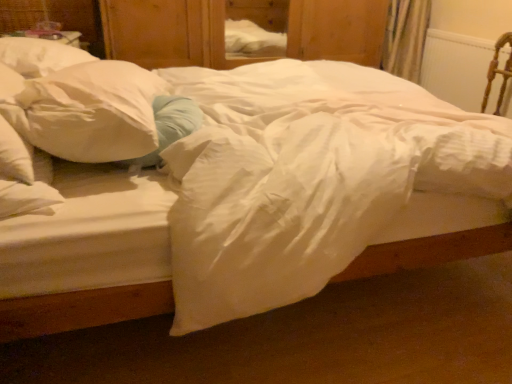
What do you see at coordinates (167, 33) in the screenshot? I see `wooden dresser at center` at bounding box center [167, 33].

The height and width of the screenshot is (384, 512). I want to click on wooden dresser at center, so click(167, 33).

Locate an element on the screen. wooden armchair at right is located at coordinates (498, 72).

At what (x,y) coordinates should I click in order to perform the action: click on white plastic radiator at upper right. Please return your answer as a coordinate pair (x, y). This screenshot has height=384, width=512. Looking at the image, I should click on (456, 67).

At what (x,y) coordinates should I click in order to perform the action: click on wooden dresser at center. Please return your answer as a coordinate pair (x, y). The width and height of the screenshot is (512, 384). Looking at the image, I should click on point(167,33).

Is white plastic radiator at upper right taller than white soft pillow at left?

Yes, white plastic radiator at upper right is taller than white soft pillow at left.

Would you say white soft pillow at left is part of white plastic radiator at upper right's contents?

No, white soft pillow at left is not surrounded by white plastic radiator at upper right.

Between white plastic radiator at upper right and white soft pillow at left, which one is positioned behind?

white plastic radiator at upper right.

Is there a large distance between white plastic radiator at upper right and white soft pillow at left?

Indeed, white plastic radiator at upper right is not near white soft pillow at left.

Locate an element on the screen. This screenshot has height=384, width=512. dresser on the left side of wooden armchair at right is located at coordinates (167, 33).

Considering the positions of point (324, 55) and point (499, 71), is point (324, 55) closer or farther from the camera than point (499, 71)?

Point (324, 55) is farther from the camera than point (499, 71).

Is wooden dresser at center positioned with its back to wooden armchair at right?

No, wooden dresser at center's orientation is not away from wooden armchair at right.

From the picture: From a real-world perspective, is wooden dresser at center on top of wooden armchair at right?

Yes, from a real-world perspective, wooden dresser at center is over wooden armchair at right

Which is farther, (485, 92) or (201, 4)?

The point (201, 4) is farther from the camera.

In the scene shown: Are wooden armchair at right and wooden dresser at center beside each other?

No, wooden armchair at right is not beside wooden dresser at center.

Looking at the image, does wooden armchair at right seem bigger or smaller compared to wooden dresser at center?

wooden armchair at right is smaller than wooden dresser at center.

At what (x,y) coordinates should I click in order to perform the action: click on pillow lying on the left of wooden armchair at right. Please return your answer as a coordinate pair (x, y). This screenshot has width=512, height=384. Looking at the image, I should click on (91, 112).

Which object is closer to the camera taking this photo, white soft pillow at left or wooden armchair at right?

white soft pillow at left.

Based on their positions, is white soft pillow at left located to the left or right of wooden armchair at right?

Clearly, white soft pillow at left is on the left of wooden armchair at right in the image.

In terms of width, does white plastic radiator at upper right look wider or thinner when compared to wooden armchair at right?

white plastic radiator at upper right is thinner than wooden armchair at right.

Relative to wooden armchair at right, is white plastic radiator at upper right in front or behind?

Visually, white plastic radiator at upper right is located behind wooden armchair at right.

From the image's perspective, does white plastic radiator at upper right appear lower than wooden armchair at right?

No, from the image's perspective, white plastic radiator at upper right is not below wooden armchair at right.

Between point (446, 32) and point (488, 70), which one is positioned in front?

Positioned in front is point (488, 70).

Is wooden dresser at center taller or shorter than white soft pillow at left?

Considering their sizes, wooden dresser at center has more height than white soft pillow at left.

Is the depth of wooden dresser at center greater than that of white soft pillow at left?

Yes, wooden dresser at center is behind white soft pillow at left.

Is wooden dresser at center wider or thinner than white soft pillow at left?

Clearly, wooden dresser at center has more width compared to white soft pillow at left.

In the image, is white soft pillow at left on the left side or the right side of white plastic radiator at upper right?

white soft pillow at left is positioned on white plastic radiator at upper right's left side.

In the scene shown: Between white soft pillow at left and white plastic radiator at upper right, which one has more height?

white plastic radiator at upper right.

Considering the sizes of objects white soft pillow at left and white plastic radiator at upper right in the image provided, who is thinner, white soft pillow at left or white plastic radiator at upper right?

Thinner between the two is white plastic radiator at upper right.

Looking at this image, from the image's perspective, is white soft pillow at left below white plastic radiator at upper right?

Yes.

Locate an element on the screen. The image size is (512, 384). radiator above the white soft pillow at left (from the image's perspective) is located at coordinates (456, 67).

You are a GUI agent. You are given a task and a screenshot of the screen. Output one action in this format:
    pyautogui.click(x=<x>, y=<y>)
    Task: Click on the armchair that is on the right side of wooden dresser at center
    This screenshot has height=384, width=512.
    Given the screenshot: What is the action you would take?
    pyautogui.click(x=498, y=72)

When comparing their distances from white soft pillow at left, does wooden armchair at right or wooden dresser at center seem further?

wooden armchair at right.

Which object lies nearer to the anchor point white soft pillow at left, wooden dresser at center or white plastic radiator at upper right?

The object closer to white soft pillow at left is wooden dresser at center.

In the scene shown: Which object lies nearer to the anchor point wooden dresser at center, white soft pillow at left or wooden armchair at right?

Based on the image, white soft pillow at left appears to be nearer to wooden dresser at center.

From the image, which object appears to be farther from white plastic radiator at upper right, wooden dresser at center or wooden armchair at right?

wooden dresser at center.

Looking at the image, which one is located further to wooden armchair at right, wooden dresser at center or white soft pillow at left?

white soft pillow at left.

When comparing their distances from white plastic radiator at upper right, does wooden armchair at right or wooden dresser at center seem closer?

Based on the image, wooden armchair at right appears to be nearer to white plastic radiator at upper right.

Looking at the image, which one is located further to white plastic radiator at upper right, white soft pillow at left or wooden armchair at right?

Based on the image, white soft pillow at left appears to be further to white plastic radiator at upper right.

When comparing their distances from white plastic radiator at upper right, does white soft pillow at left or wooden dresser at center seem further?

white soft pillow at left is positioned further to the anchor white plastic radiator at upper right.

Identify the location of radiator between wooden dresser at center and wooden armchair at right from left to right. This screenshot has height=384, width=512. [456, 67].

Identify the location of dresser between white soft pillow at left and white plastic radiator at upper right in the horizontal direction. (167, 33).

Locate an element on the screen. The width and height of the screenshot is (512, 384). radiator between white soft pillow at left and wooden armchair at right is located at coordinates (456, 67).

At what (x,y) coordinates should I click in order to perform the action: click on dresser located between white soft pillow at left and wooden armchair at right in the left-right direction. Please return your answer as a coordinate pair (x, y). Looking at the image, I should click on (167, 33).